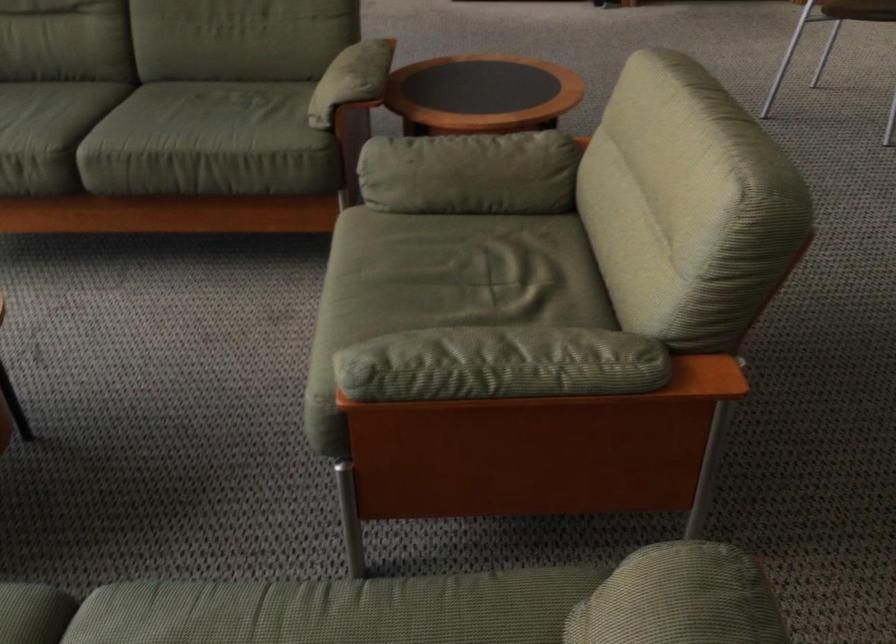
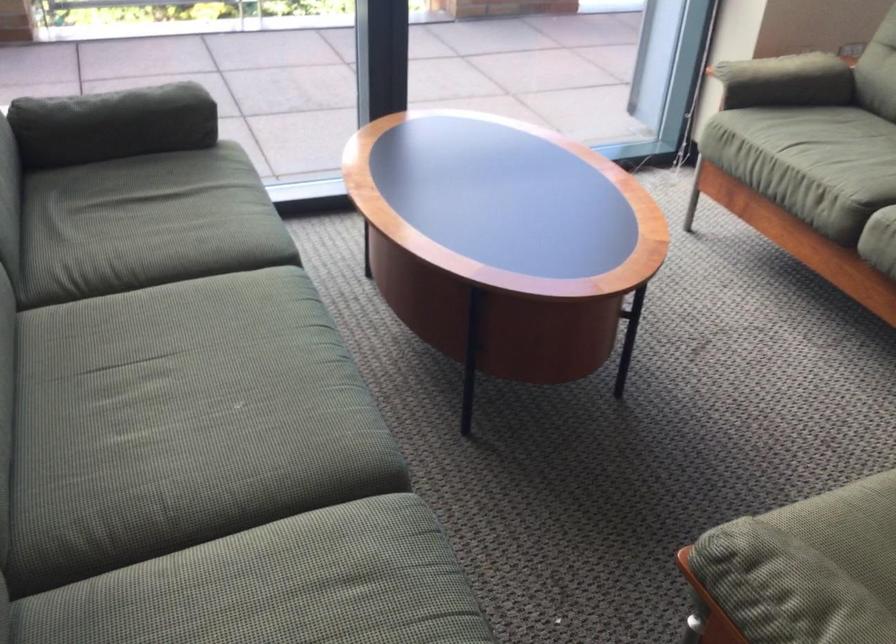
The point at (421,355) is marked in the first image. Where is the corresponding point in the second image?

(785, 588)